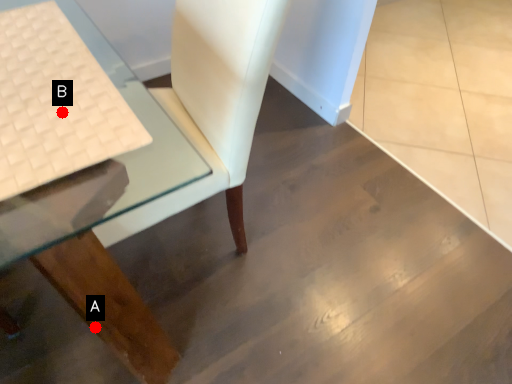
Question: Two points are circled on the image, labeled by A and B beside each circle. Which point is closer to the camera taking this photo?

Choices:
 (A) A is closer
 (B) B is closer

Answer: (B)